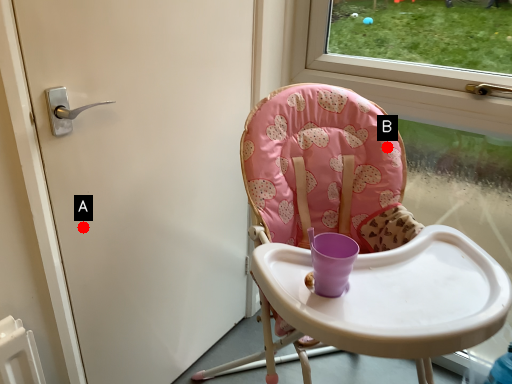
Question: Two points are circled on the image, labeled by A and B beside each circle. Which point appears farthest from the camera in this image?

Choices:
 (A) A is further
 (B) B is further

Answer: (B)